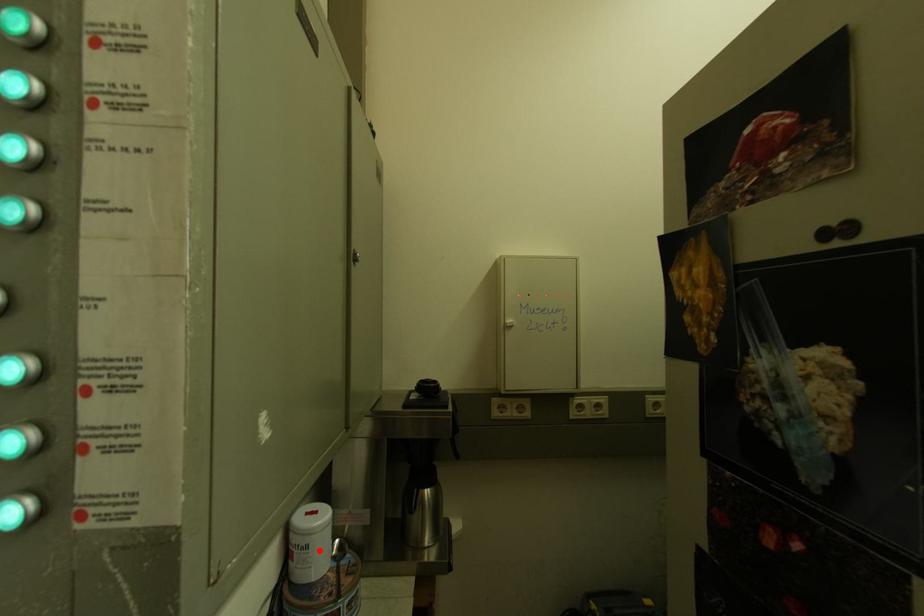
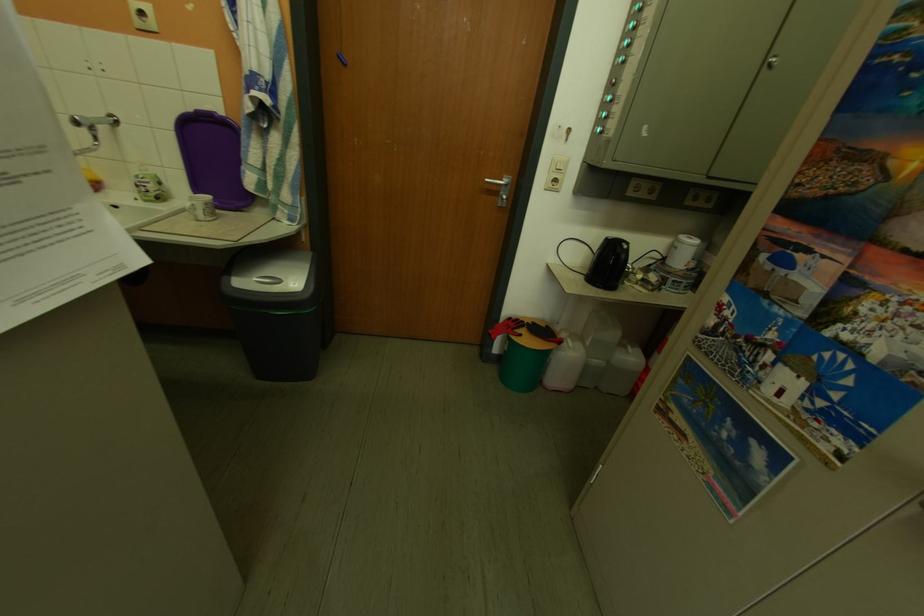
Locate, in the second image, the point that corresponds to the highlighted location in the first image.

(689, 251)